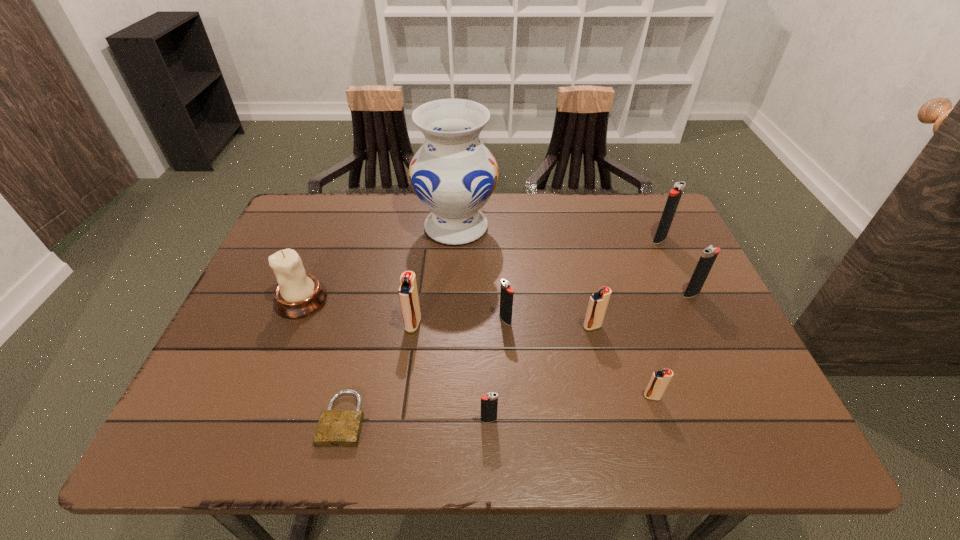
Where is `free location that satisfies the following two spatial constraints: 1. on the front side of the leftmost object; 2. on the right side of the nearest black igniter`? free location that satisfies the following two spatial constraints: 1. on the front side of the leftmost object; 2. on the right side of the nearest black igniter is located at coordinates (254, 420).

This screenshot has height=540, width=960. Identify the location of free region that satisfies the following two spatial constraints: 1. on the front side of the vase; 2. on the left side of the second farthest igniter. (452, 294).